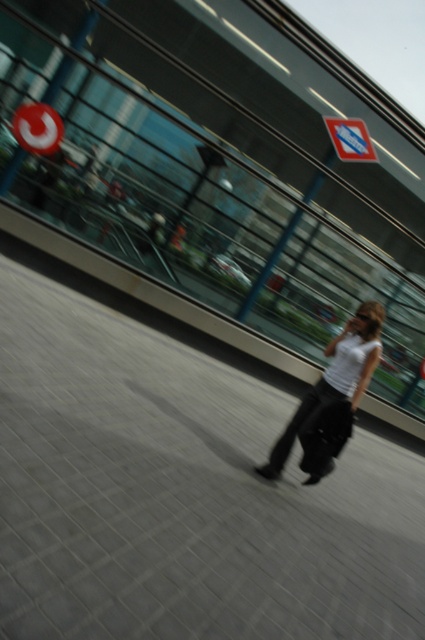
You are a delivery person trying to locate a store in the city. You see a matte red circle at upper left and a blue reflective sign at upper center. Which object is located more to the left?

The matte red circle at upper left is more to the left than the blue reflective sign at upper center.

You are a photographer trying to capture the person in the white matte shirt at center and the blue reflective sign at upper center in the same frame. Which object should you focus on first if you want to ensure both are in focus?

The white matte shirt at center is taller than the blue reflective sign at upper center, so you should focus on the white matte shirt at center first to ensure both are in focus.

Consider the image. You are a delivery person who needs to read a sign. You see the matte red circle at upper left and the blue reflective sign at upper center. Which object is taller?

The matte red circle at upper left is much taller than the blue reflective sign at upper center according to the description.